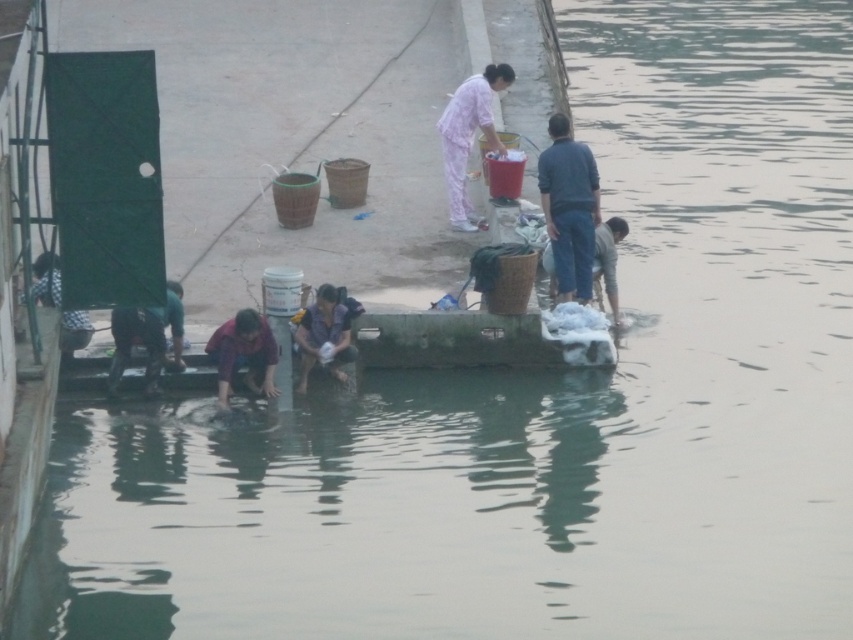
Is purple fabric at lower center bigger than light brown fabric pants at lower right?

Correct, purple fabric at lower center is larger in size than light brown fabric pants at lower right.

Between point (332, 346) and point (608, 285), which one is positioned in front?

Point (332, 346) is more forward.

This screenshot has width=853, height=640. Find the location of `purple fabric at lower center`. purple fabric at lower center is located at coordinates (325, 332).

Looking at this image, between purple matte shirt at lower center and purple fabric at lower center, which one has more height?

Standing taller between the two is purple fabric at lower center.

Is point (265, 384) positioned after point (296, 346)?

No, it is not.

Locate an element on the screen. The width and height of the screenshot is (853, 640). purple matte shirt at lower center is located at coordinates (242, 355).

Can you confirm if pink fabric at center is positioned to the right of purple matte shirt at lower center?

Correct, you'll find pink fabric at center to the right of purple matte shirt at lower center.

Is pink fabric at center to the left of purple matte shirt at lower center from the viewer's perspective?

No, pink fabric at center is not to the left of purple matte shirt at lower center.

In order to click on pink fabric at center in this screenshot , I will do `click(469, 134)`.

The height and width of the screenshot is (640, 853). I want to click on pink fabric at center, so click(469, 134).